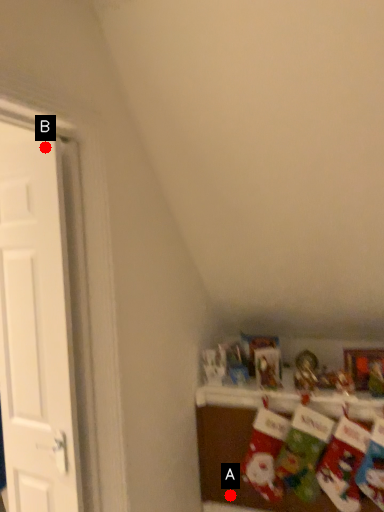
Question: Two points are circled on the image, labeled by A and B beside each circle. Which point is farther from the camera taking this photo?

Choices:
 (A) A is further
 (B) B is further

Answer: (A)